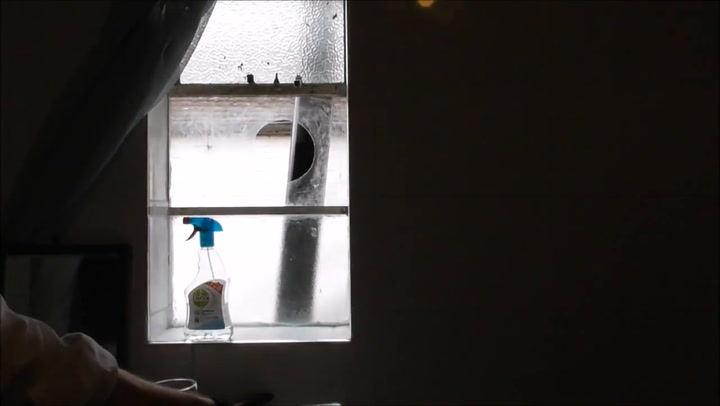
Identify the location of top edge of bowl or cup. (188, 382).